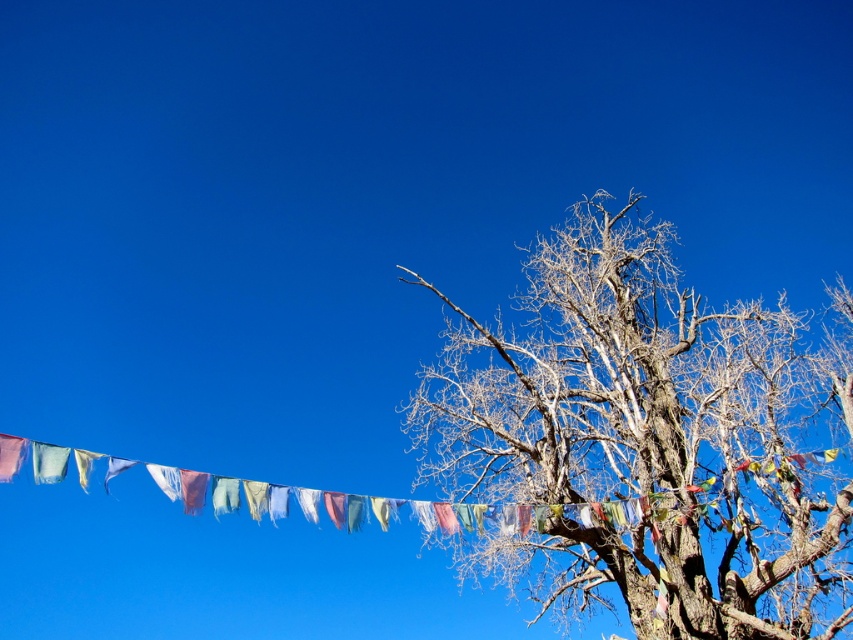
Question: Does dead wood tree at right have a lesser width compared to matte blue flag at upper left?

Choices:
 (A) no
 (B) yes

Answer: (A)

Question: Does dead wood tree at right come in front of matte blue flag at upper left?

Choices:
 (A) no
 (B) yes

Answer: (A)

Question: Is dead wood tree at right to the left of matte blue flag at upper left from the viewer's perspective?

Choices:
 (A) no
 (B) yes

Answer: (A)

Question: Which point is closer to the camera?

Choices:
 (A) (0, 445)
 (B) (538, 474)

Answer: (A)